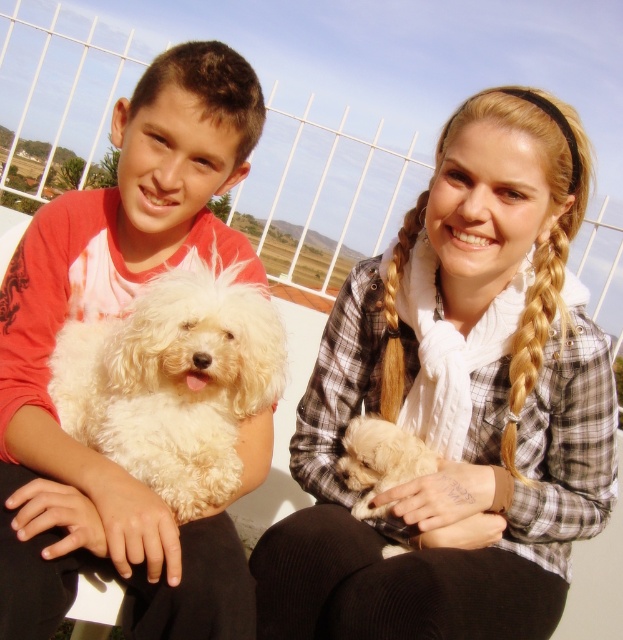
You are trying to decide whether to place a new accessory on the plaid shirt at center or the white fluffy dog at left. Based on their positions in the image, which one is located lower?

The plaid shirt at center is positioned under the white fluffy dog at left, so the plaid shirt at center is lower.

You are a photographer trying to capture a closeup of the blonde braided hair at upper right and the golden braided hair at upper right. Which one is located to the right side of the other?

The blonde braided hair at upper right is positioned on the right side of golden braided hair at upper right.

What is the 2D coordinate of the blonde braided hair at upper right?

The 2D coordinate of the blonde braided hair at upper right is at point (535, 330).